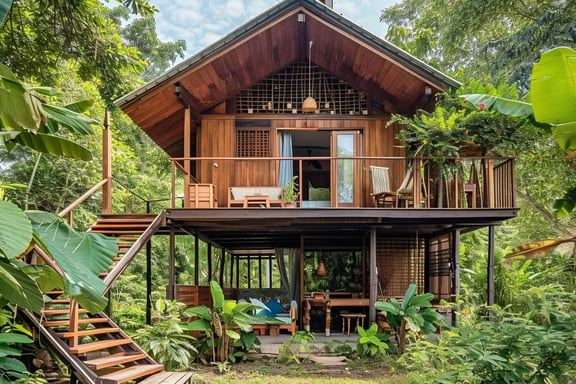
Identify the location of stairway up. This screenshot has height=384, width=576. (102, 344), (96, 229).